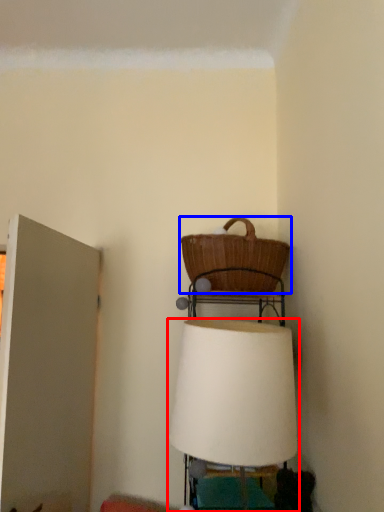
Question: Which object appears farthest to the camera in this image, lamp (highlighted by a red box) or picnic basket (highlighted by a blue box)?

Choices:
 (A) lamp
 (B) picnic basket

Answer: (B)